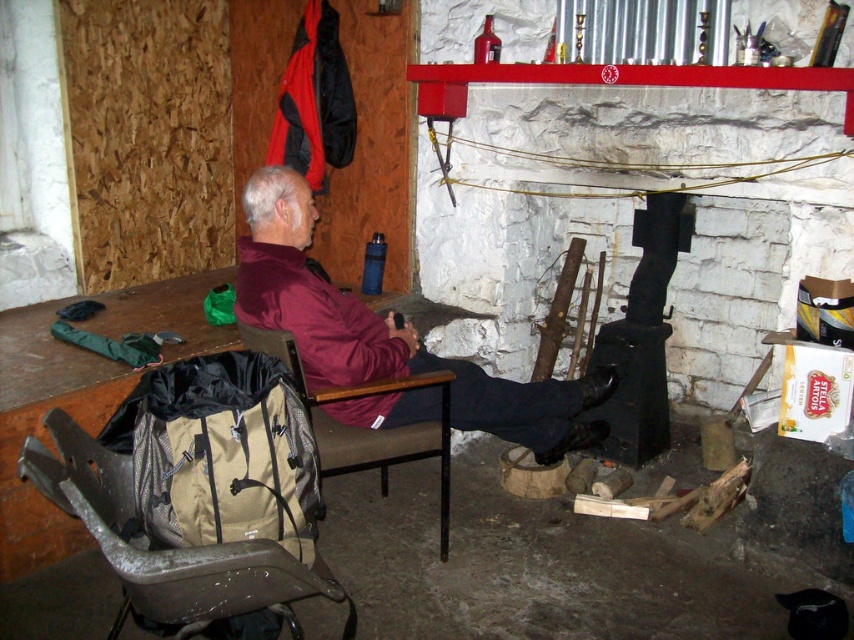
Which is more to the left, red/black jacket at upper left or brown fabric chair at left?

Positioned to the left is red/black jacket at upper left.

Can you confirm if red/black jacket at upper left is wider than brown fabric chair at left?

No.

Measure the distance between point (290, 115) and camera.

Point (290, 115) is 11.37 feet away from camera.

Where is `red/black jacket at upper left`? The width and height of the screenshot is (854, 640). red/black jacket at upper left is located at coordinates pyautogui.click(x=314, y=100).

The width and height of the screenshot is (854, 640). Describe the element at coordinates (385, 332) in the screenshot. I see `maroon fabric jacket at center` at that location.

Who is positioned more to the right, maroon fabric jacket at center or beige fabric folding chair at lower left?

maroon fabric jacket at center is more to the right.

Which is behind, point (313, 316) or point (348, 628)?

Positioned behind is point (313, 316).

Where is `maroon fabric jacket at center`? maroon fabric jacket at center is located at coordinates (385, 332).

Does maroon fabric jacket at center appear on the left side of red/black jacket at upper left?

No, maroon fabric jacket at center is not to the left of red/black jacket at upper left.

Who is taller, maroon fabric jacket at center or red/black jacket at upper left?

Standing taller between the two is maroon fabric jacket at center.

Does point (417, 371) come closer to viewer compared to point (323, 131)?

Yes, point (417, 371) is in front of point (323, 131).

Locate an element on the screen. This screenshot has width=854, height=640. maroon fabric jacket at center is located at coordinates (385, 332).